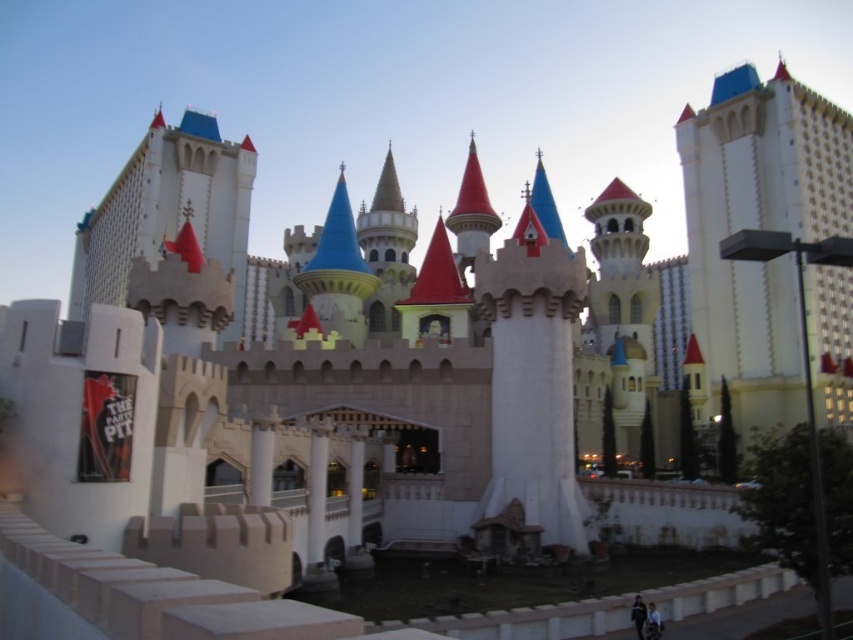
Question: Among these points, which one is nearest to the camera?

Choices:
 (A) (790, 365)
 (B) (122, 234)

Answer: (A)

Question: Which point is farther to the camera?

Choices:
 (A) (811, 362)
 (B) (213, 211)

Answer: (B)

Question: Is white stone castle at right to the left of white stone castle at upper left from the viewer's perspective?

Choices:
 (A) yes
 (B) no

Answer: (B)

Question: Is white stone castle at right above white stone castle at upper left?

Choices:
 (A) yes
 (B) no

Answer: (B)

Question: Is white stone castle at right below white stone castle at upper left?

Choices:
 (A) no
 (B) yes

Answer: (B)